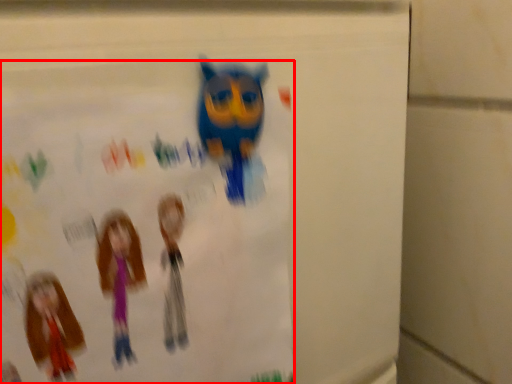
Question: Where is poster (annotated by the red box) located in relation to toy in the image?

Choices:
 (A) left
 (B) right

Answer: (A)